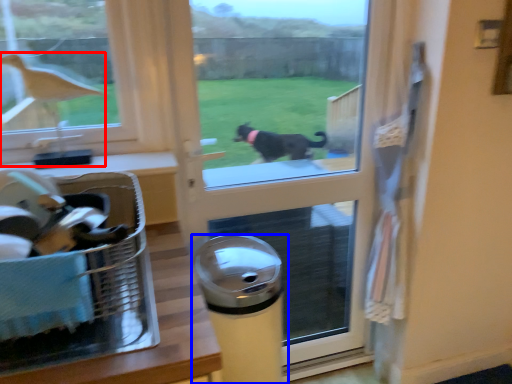
Question: Which point is further to the camera, bird (highlighted by a red box) or waste container (highlighted by a blue box)?

Choices:
 (A) bird
 (B) waste container

Answer: (B)